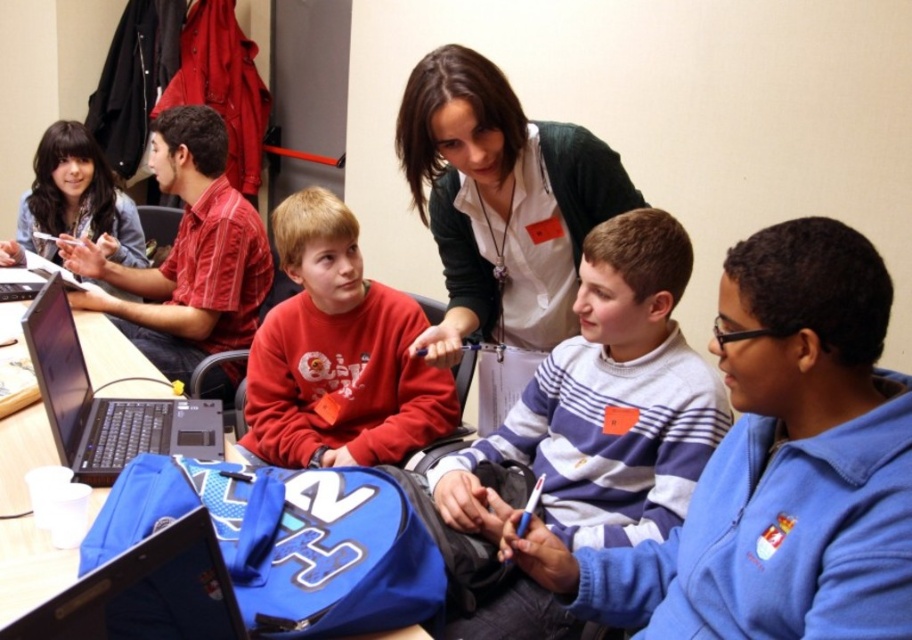
Question: Estimate the real-world distances between objects in this image. Which object is closer to the blue fabric backpack at center?

Choices:
 (A) white shirt at center
 (B) matte red sweatshirt at center

Answer: (B)

Question: Which object appears closest to the camera in this image?

Choices:
 (A) white shirt at center
 (B) blue fabric backpack at center
 (C) shiny black laptop at lower left
 (D) matte red sweatshirt at center

Answer: (C)

Question: Can you confirm if white shirt at center is bigger than matte red sweatshirt at center?

Choices:
 (A) no
 (B) yes

Answer: (B)

Question: Is blue fleece jacket at right smaller than shiny black laptop at lower left?

Choices:
 (A) no
 (B) yes

Answer: (A)

Question: Estimate the real-world distances between objects in this image. Which object is farther from the shiny black laptop at lower left?

Choices:
 (A) matte red sweatshirt at center
 (B) striped cotton sweater at center
 (C) blue fabric backpack at center

Answer: (A)

Question: Does blue fleece jacket at right have a greater width compared to blue fabric backpack at center?

Choices:
 (A) no
 (B) yes

Answer: (A)